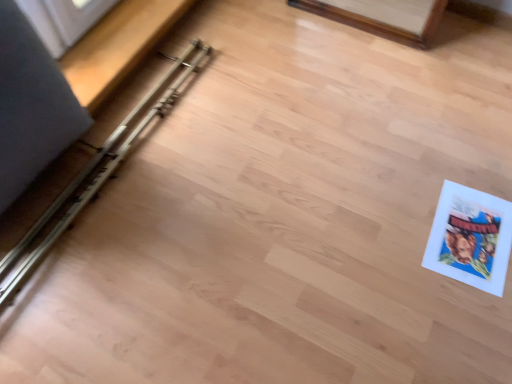
You are a GUI agent. You are given a task and a screenshot of the screen. Output one action in this format:
    pyautogui.click(x=<x>, y=<y>)
    Task: Click on the vacant space that is to the left of white paper comic book at lower right
    The height and width of the screenshot is (384, 512).
    Given the screenshot: What is the action you would take?
    pyautogui.click(x=388, y=231)